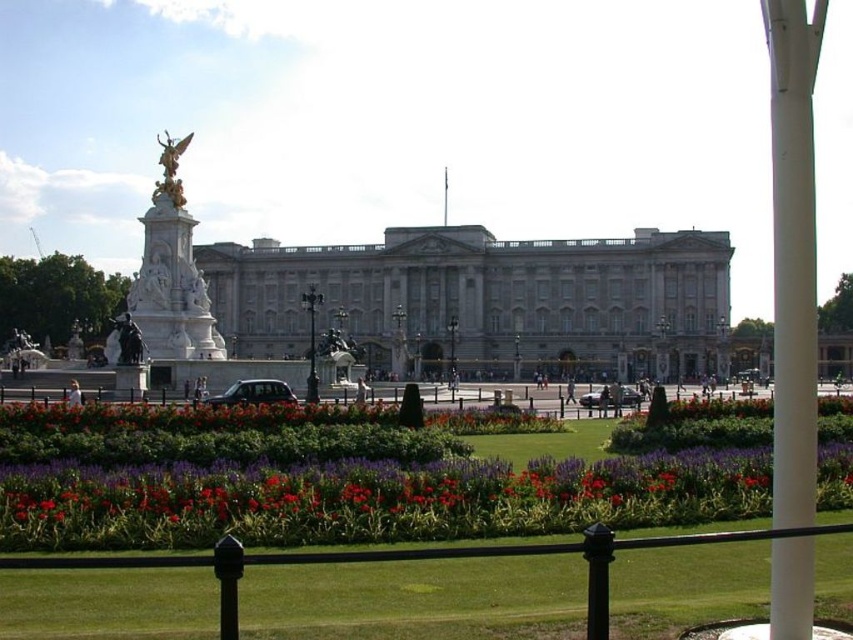
Is white marble statue at upper left positioned in front of gold polished statue at upper left?

Yes.

Between white marble statue at upper left and gold polished statue at upper left, which one appears on the right side from the viewer's perspective?

From the viewer's perspective, gold polished statue at upper left appears more on the right side.

What are the coordinates of `white marble statue at upper left` in the screenshot? It's located at (171, 273).

This screenshot has height=640, width=853. In order to click on white marble statue at upper left in this screenshot , I will do `click(171, 273)`.

Is point (810, 588) in front of point (164, 216)?

Yes, point (810, 588) is in front of point (164, 216).

Between white smooth pole at right and white marble statue at upper left, which one has less height?

white marble statue at upper left

Does point (804, 230) come farther from viewer compared to point (149, 358)?

No, it is in front of (149, 358).

This screenshot has height=640, width=853. In order to click on white smooth pole at right in this screenshot , I will do `click(793, 253)`.

Is the position of stone/brick palace at center more distant than that of white smooth pole at right?

Yes, stone/brick palace at center is behind white smooth pole at right.

Is point (483, 244) in front of point (814, 269)?

No.

Find the location of a particular element. stone/brick palace at center is located at coordinates (485, 300).

You are a GUI agent. You are given a task and a screenshot of the screen. Output one action in this format:
    pyautogui.click(x=<x>, y=<y>)
    Task: Click on the stone/brick palace at center
    The height and width of the screenshot is (640, 853).
    Given the screenshot: What is the action you would take?
    pyautogui.click(x=485, y=300)